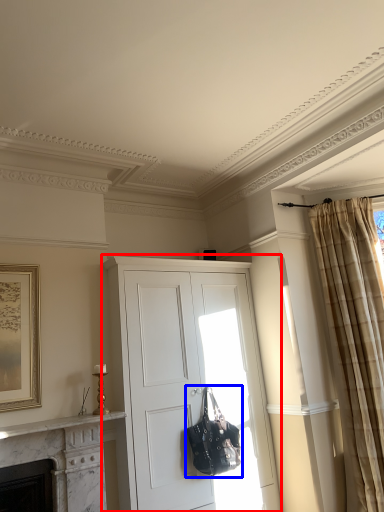
Question: Which of the following is the farthest to the observer, cabinetry (highlighted by a red box) or handbag (highlighted by a blue box)?

Choices:
 (A) cabinetry
 (B) handbag

Answer: (B)